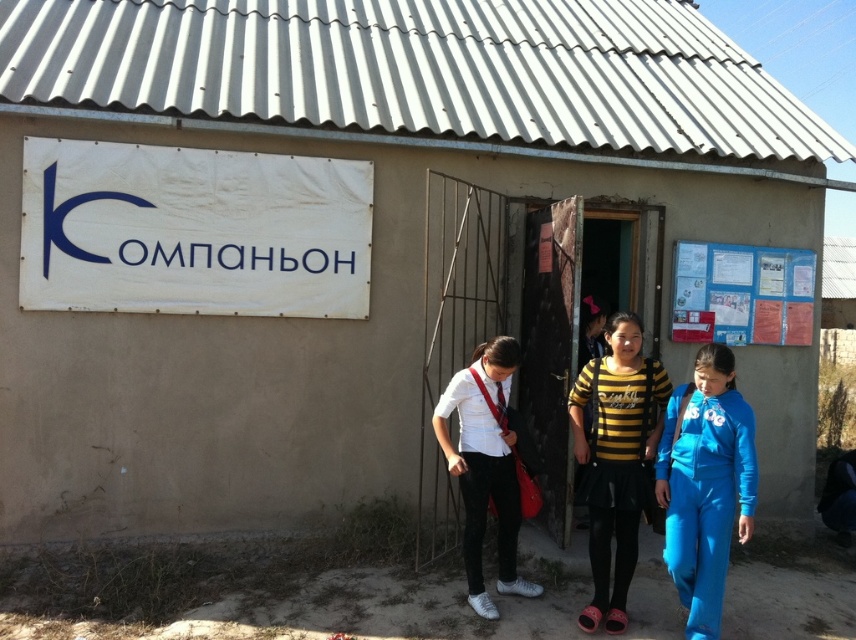
You are a photographer planning to take a group photo of the blue fleece tracksuit at lower right and the yellow black striped shirt at center. Which person should you ask to move closer to the camera to make them appear the same size in the photo?

The blue fleece tracksuit at lower right is smaller in size compared to the yellow black striped shirt at center. To make them appear the same size in the photo, the blue fleece tracksuit at lower right should move closer to the camera.

You are a photographer trying to capture the blue fleece tracksuit at lower right and the blue paperboard at upper right in the same frame. Considering their sizes, which object will appear smaller in your photo?

The blue fleece tracksuit at lower right will appear smaller in the photo because it has a lesser width compared to the blue paperboard at upper right.

You are a visitor approaching the building and see the blue fleece tracksuit at lower right and the blue paperboard at upper right. Which object is closer to you as you face the building?

The blue fleece tracksuit at lower right is closer to you because it is in front of the blue paperboard at upper right.